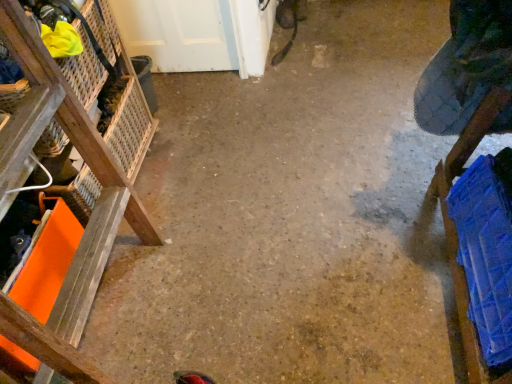
I want to click on wooden crate at left, so click(x=87, y=225).

Image resolution: width=512 pixels, height=384 pixels. What do you see at coordinates (87, 225) in the screenshot?
I see `wooden crate at left` at bounding box center [87, 225].

Where is `wooden crate at left`? The height and width of the screenshot is (384, 512). wooden crate at left is located at coordinates (87, 225).